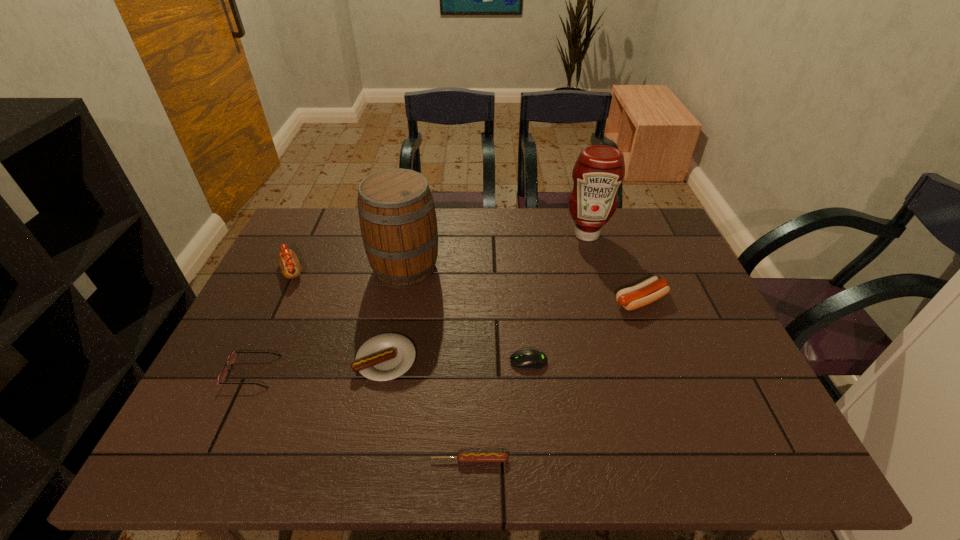
Where is `the farthest object`? the farthest object is located at coordinates (599, 170).

Find the location of a particular element. cider is located at coordinates (398, 222).

Where is `the farthest sausage`? This screenshot has width=960, height=540. the farthest sausage is located at coordinates (288, 261).

Identify the location of the second farthest sausage. (651, 289).

Locate an element on the screen. This screenshot has width=960, height=540. the third tallest sausage is located at coordinates (384, 357).

Identify the location of the second nearest sausage. The image size is (960, 540). (384, 357).

Image resolution: width=960 pixels, height=540 pixels. I want to click on sunglasses, so click(x=232, y=358).

At what (x,y) coordinates should I click in order to perform the action: click on the sixth object from left to right. Please return your answer as a coordinate pair (x, y). Image resolution: width=960 pixels, height=540 pixels. Looking at the image, I should click on (529, 359).

Find the location of a particular element. the second shortest object is located at coordinates (529, 359).

I want to click on the nearest sausage, so click(463, 457).